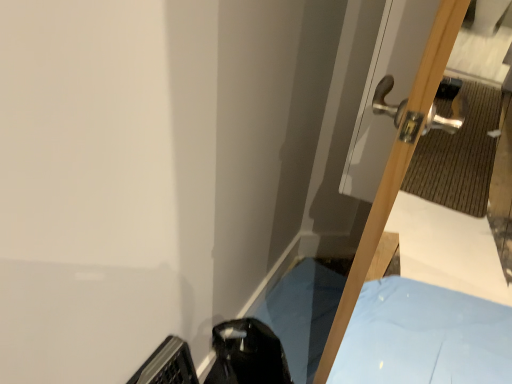
Find the location of a particular element. This screenshot has width=512, height=384. vacant space underneath metallic silver door at upper right (from a real-world perspective) is located at coordinates (326, 334).